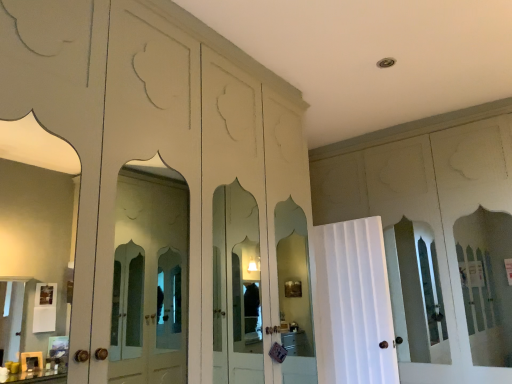
In order to click on white matte curtain at center in this screenshot , I will do `click(353, 304)`.

Measure the distance between white matte curtain at center and camera.

They are 3.19 meters apart.

Image resolution: width=512 pixels, height=384 pixels. Describe the element at coordinates (353, 304) in the screenshot. I see `white matte curtain at center` at that location.

From the picture: What is the approximate height of white matte curtain at center?

The height of white matte curtain at center is 4.49 feet.

Find the location of a particular element. white matte curtain at center is located at coordinates (353, 304).